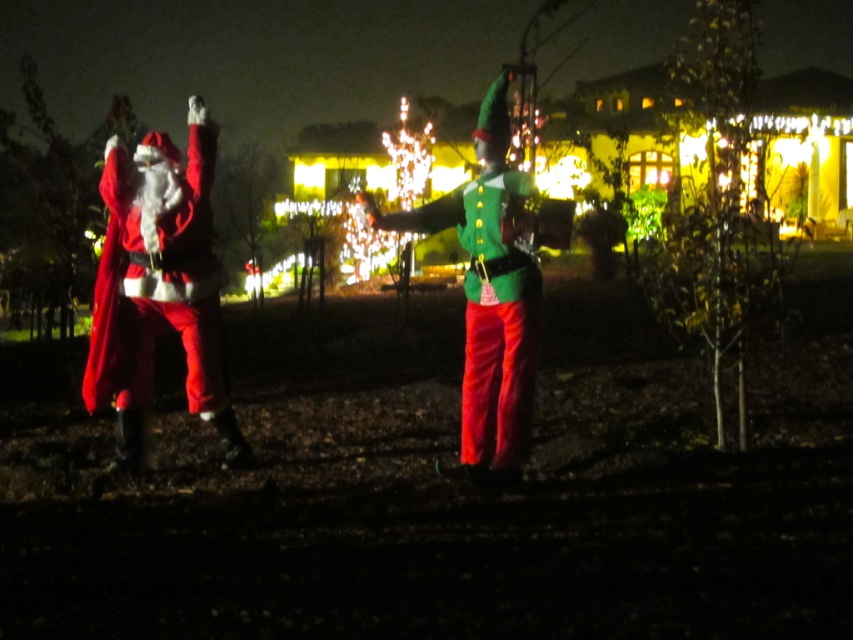
You are standing in the middle of the scene and want to move towards the velvet red santa at left. Which direction should you move?

Since the velvet red santa at left is located at point (160,285), you should move to the left and slightly forward to reach him.

You are a photographer trying to capture a photo of both the velvet red santa at left and the green matte elf at center. Since you want to ensure both are in focus, you need to know which one is taller. Can you tell me which is taller?

The velvet red santa at left is taller than the green matte elf at center, so you should adjust your camera settings to accommodate the height difference for proper focus.

Based on the photo, you are standing in the nighttime scene and want to place a small decoration exactly at the point with coordinates point (160,285). Which object from the scene should you attach it to?

The point (160,285) is on velvet red santa at left, so you should attach the decoration to the velvet red santa at left.